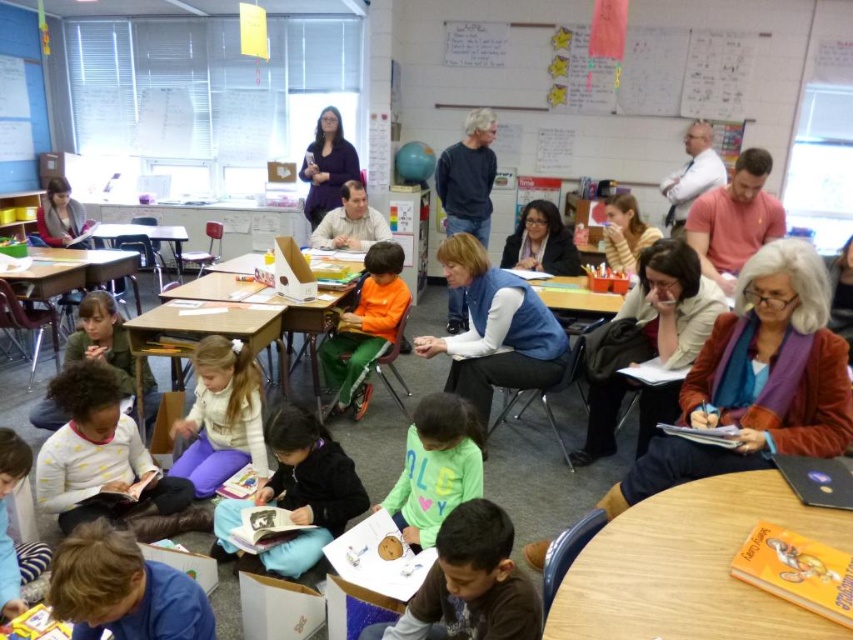
You are a student in the classroom and you want to place your backpack on the blue sweater at center and the matte wood table at lower left. Which object can you place your backpack on without it touching the floor?

The blue sweater at center has a greater height compared to matte wood table at lower left, so placing the backpack on the blue sweater at center would allow it to not touch the floor since it is taller than the matte wood table at lower left.

You are standing in the classroom and want to move from the point at coordinates point (x=154, y=404) to the point at coordinates point (x=608, y=298). Based on their positions, which direction should you move to get closer to your destination?

To move from point (x=154, y=404) to point (x=608, y=298), you should move backward since point (x=154, y=404) is in front of point (x=608, y=298).